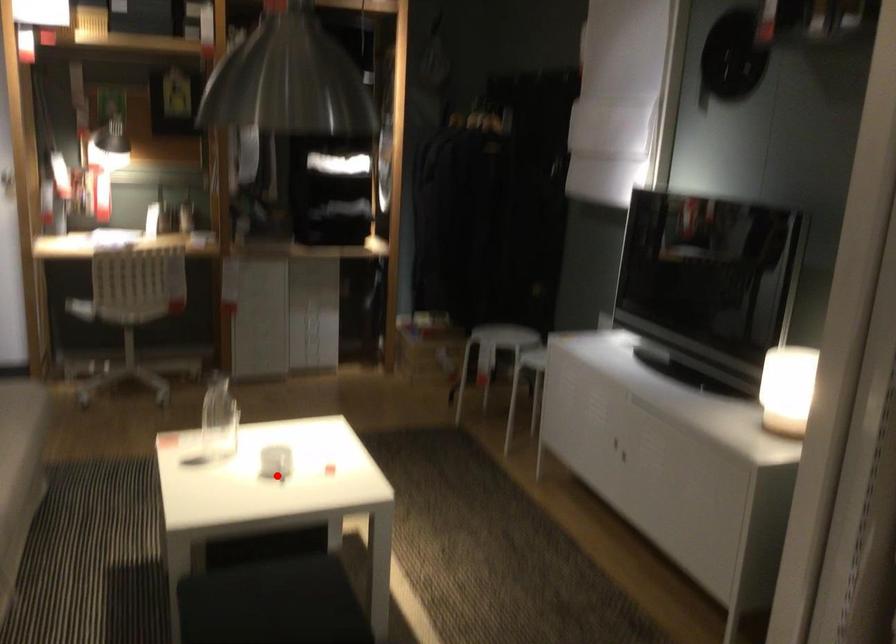
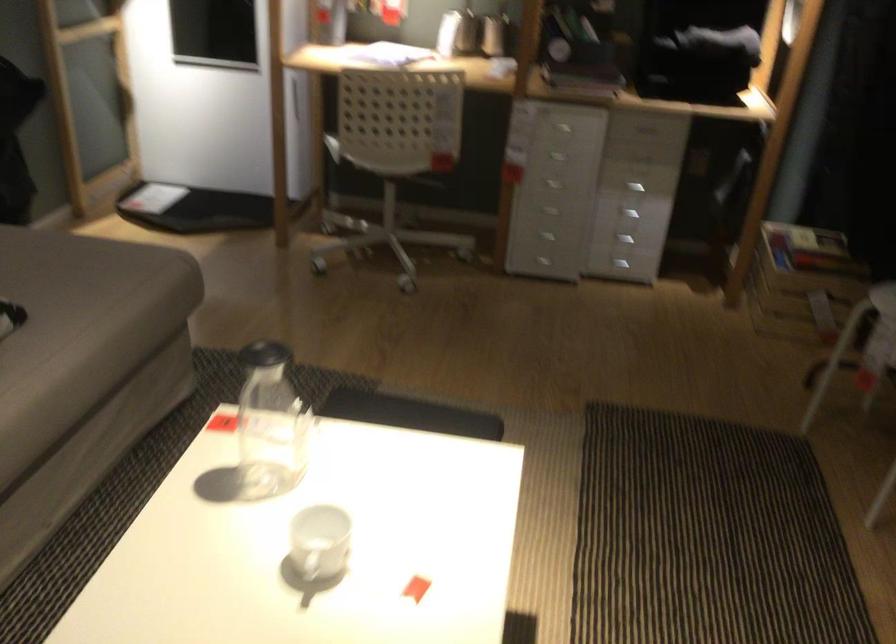
Question: A red point is marked in image1. In image2, is the corresponding 3D point closer to the camera or farther? Reply with the corresponding letter.

Choices:
 (A) The corresponding 3D point is closer.
 (B) The corresponding 3D point is farther.

Answer: (A)